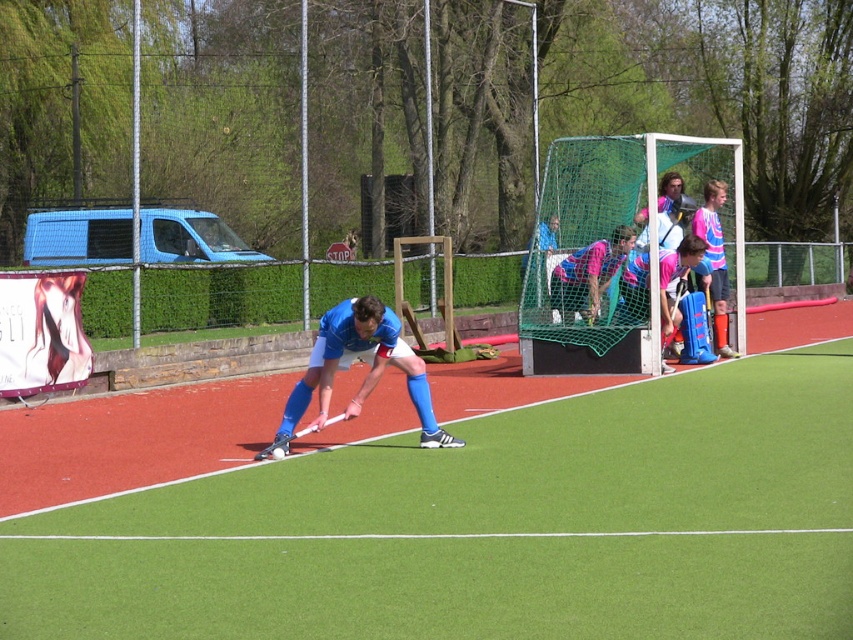
Question: Which of the following is the farthest from the observer?

Choices:
 (A) matte pink jersey at center
 (B) blue synthetic hockey stick at center
 (C) green artificial turf at center
 (D) pink jersey at goal

Answer: (A)

Question: Is pink jersey at goal positioned behind pink striped shirt at right?

Choices:
 (A) no
 (B) yes

Answer: (A)

Question: Which of the following is the closest to the observer?

Choices:
 (A) pink striped shirt at right
 (B) pink jersey at goal
 (C) green artificial turf at center
 (D) blue synthetic hockey stick at center

Answer: (C)

Question: Can you confirm if pink jersey at goal is wider than matte pink jersey at center?

Choices:
 (A) yes
 (B) no

Answer: (B)

Question: Among these points, which one is farthest from the camera?

Choices:
 (A) (631, 300)
 (B) (418, 406)
 (C) (590, 376)
 (D) (581, 291)

Answer: (A)

Question: Is green net at upper right bigger than matte pink jersey at center?

Choices:
 (A) yes
 (B) no

Answer: (A)